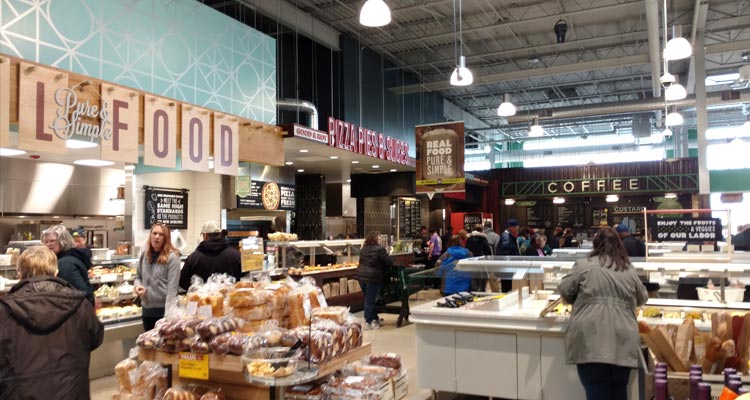
The height and width of the screenshot is (400, 750). Find the location of `coffee sign, top right of center`. coffee sign, top right of center is located at coordinates (597, 187).